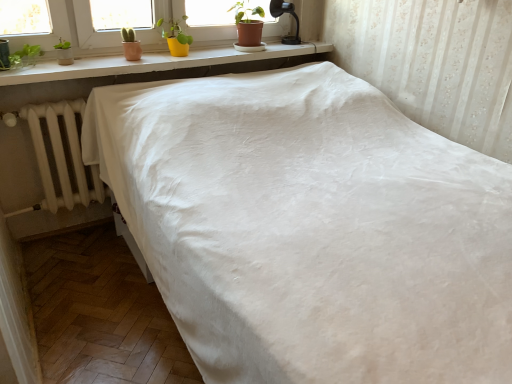
Locate an element on the screen. The width and height of the screenshot is (512, 384). free space that is to the left of matte brown pot at upper center, the 1th houseplant viewed from the right is located at coordinates (214, 52).